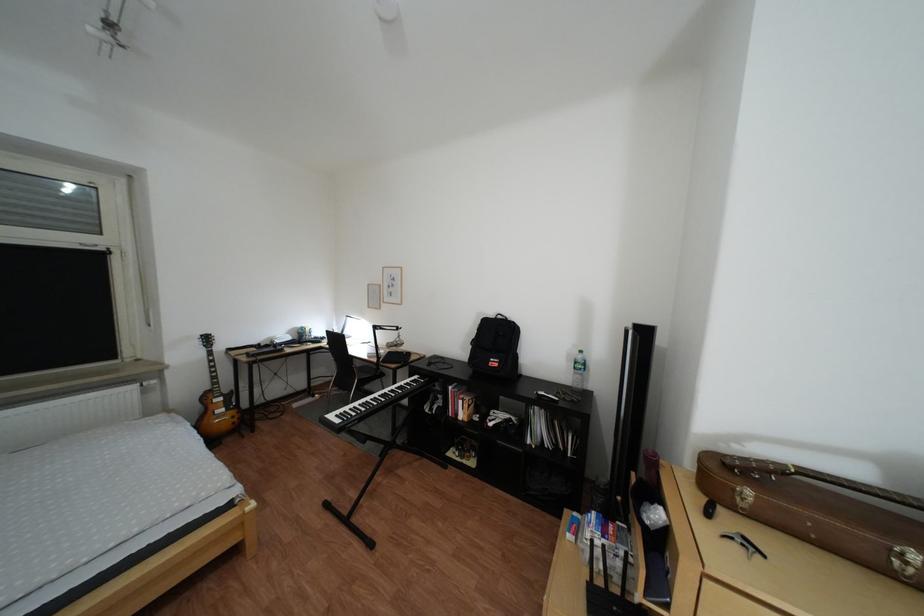
Locate an element on the screen. Image resolution: width=924 pixels, height=616 pixels. keyboard keys is located at coordinates (372, 403).